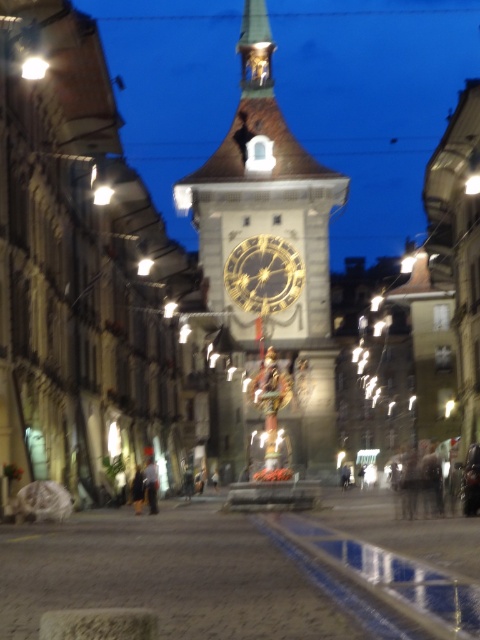
Is gold-plated clock tower at center smaller than gold metallic clock at center?

No, gold-plated clock tower at center is not smaller than gold metallic clock at center.

Who is more forward, (x=307, y=198) or (x=268, y=259)?

Point (x=268, y=259)

Is point (250, 298) positioned after point (249, 304)?

No, (250, 298) is closer to viewer.

Where is `gold-plated clock tower at center`? Image resolution: width=480 pixels, height=640 pixels. gold-plated clock tower at center is located at coordinates (264, 264).